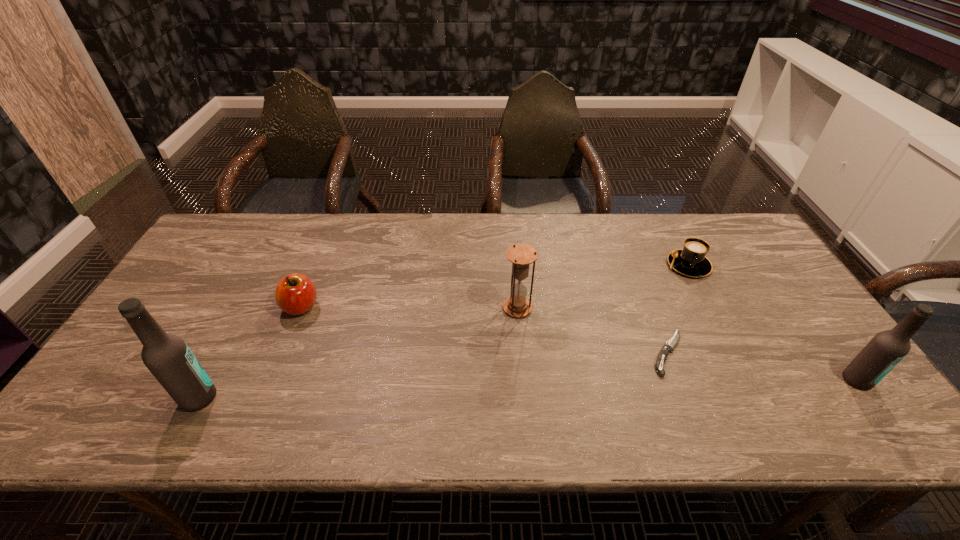
This screenshot has height=540, width=960. I want to click on vacant space that's between the taller beer bottle and the cappuccino, so click(444, 332).

The image size is (960, 540). I want to click on empty location between the fifth object from right to left and the third object from right to left, so click(x=485, y=330).

Image resolution: width=960 pixels, height=540 pixels. I want to click on vacant area that lies between the rightmost object and the shortest object, so click(x=762, y=367).

In order to click on vacant point located between the shorter beer bottle and the pocketknife in this screenshot , I will do `click(762, 367)`.

At what (x,y) coordinates should I click in order to perform the action: click on free space between the shorter beer bottle and the tallest object. Please return your answer as a coordinate pair (x, y). The width and height of the screenshot is (960, 540). Looking at the image, I should click on (528, 389).

You are a GUI agent. You are given a task and a screenshot of the screen. Output one action in this format:
    pyautogui.click(x=<x>, y=<y>)
    Task: Click on the vacant space that is in between the farthest object and the third object from left to right
    The image size is (960, 540).
    Given the screenshot: What is the action you would take?
    pyautogui.click(x=603, y=287)

Identify which object is the third nearest to the cappuccino. Please provide its 2D coordinates. Your answer should be formatted as a tuple, i.e. [(x, y)], where the tuple contains the x and y coordinates of a point satisfying the conditions above.

[(521, 255)]

I want to click on the fourth closest object to the fourth tallest object, so click(691, 261).

The height and width of the screenshot is (540, 960). What are the coordinates of `free spot that satisfies the following two spatial constraints: 1. on the label of the rightmost object; 2. on the label of the taller beer bottle` in the screenshot? It's located at pos(870,397).